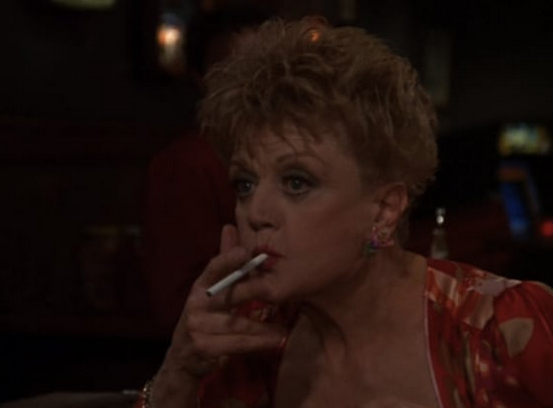
The width and height of the screenshot is (553, 408). Find the location of `light`. light is located at coordinates (171, 55).